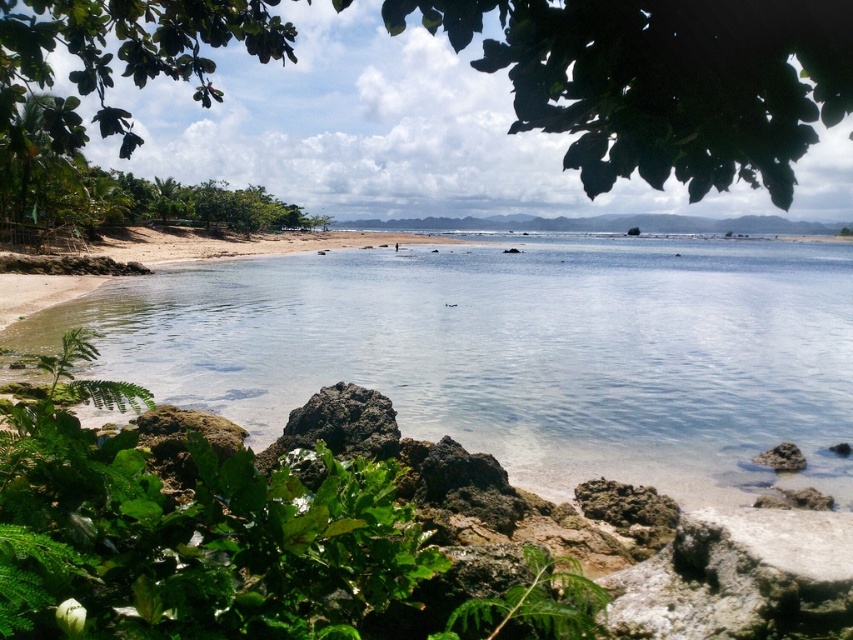
How distant is clear water at beach left from brown rock at lower right?

clear water at beach left is 37.65 feet from brown rock at lower right.

Consider the image. Who is lower down, clear water at beach left or brown rock at lower right?

Positioned lower is brown rock at lower right.

At what (x,y) coordinates should I click in order to perform the action: click on clear water at beach left. Please return your answer as a coordinate pair (x, y). Looking at the image, I should click on (515, 352).

From the picture: Who is positioned more to the right, green leafy tree at upper center or brown rock at lower right?

From the viewer's perspective, brown rock at lower right appears more on the right side.

Does green leafy tree at upper center have a greater height compared to brown rock at lower right?

Indeed, green leafy tree at upper center has a greater height compared to brown rock at lower right.

I want to click on green leafy tree at upper center, so click(663, 81).

Is clear water at beach left wider than green leafy tree at upper center?

Incorrect, clear water at beach left's width does not surpass green leafy tree at upper center's.

Which is behind, point (637, 321) or point (82, 128)?

Point (637, 321)

Which is behind, point (489, 348) or point (781, 80)?

Positioned behind is point (489, 348).

What are the coordinates of `clear water at beach left` in the screenshot? It's located at (515, 352).